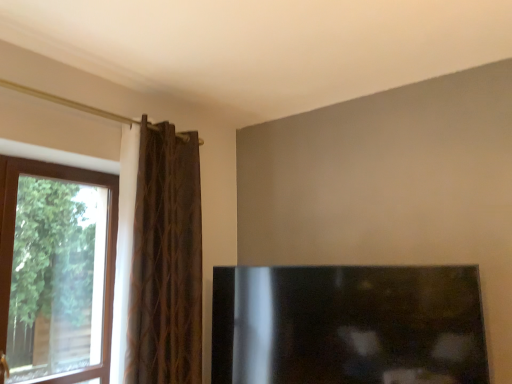
Question: Based on their positions, is black glossy fireplace at lower right located to the left or right of brown textured curtain at left?

Choices:
 (A) left
 (B) right

Answer: (B)

Question: From the image's perspective, is black glossy fireplace at lower right above or below brown textured curtain at left?

Choices:
 (A) below
 (B) above

Answer: (A)

Question: Based on their relative distances, which object is nearer to the black glossy fireplace at lower right?

Choices:
 (A) transparent glass window at left
 (B) brown textured curtain at left

Answer: (B)

Question: Estimate the real-world distances between objects in this image. Which object is farther from the transparent glass window at left?

Choices:
 (A) black glossy fireplace at lower right
 (B) brown textured curtain at left

Answer: (A)